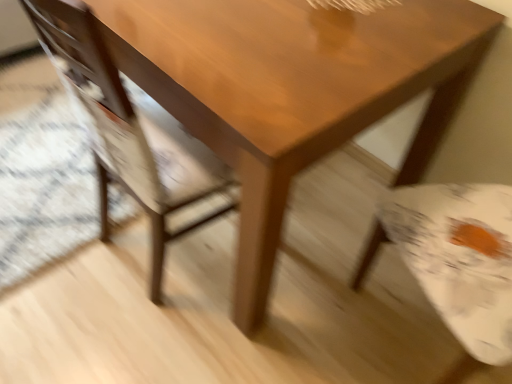
Measure the distance between point (x=77, y=58) and camera.

Point (x=77, y=58) and camera are 84.80 centimeters apart from each other.

The height and width of the screenshot is (384, 512). What do you see at coordinates (129, 131) in the screenshot?
I see `matte wood chair at center` at bounding box center [129, 131].

Find the location of `matte wood chair at center`. matte wood chair at center is located at coordinates 129,131.

This screenshot has width=512, height=384. What do you see at coordinates (293, 91) in the screenshot?
I see `glossy wood table at center` at bounding box center [293, 91].

In order to click on glossy wood table at center in this screenshot , I will do `click(293, 91)`.

The height and width of the screenshot is (384, 512). I want to click on matte wood chair at center, so click(x=129, y=131).

Visually, is matte wood chair at center positioned to the left or to the right of glossy wood table at center?

matte wood chair at center is positioned on glossy wood table at center's left side.

Who is more distant, matte wood chair at center or glossy wood table at center?

glossy wood table at center is further away from the camera.

Which point is more forward, (115,69) or (237,285)?

The point (115,69) is closer.

Consider the image. From the image's perspective, between matte wood chair at center and glossy wood table at center, who is located below?

matte wood chair at center is shown below in the image.

Looking at this image, from a real-world perspective, is matte wood chair at center beneath glossy wood table at center?

No, from a real-world perspective, matte wood chair at center is not beneath glossy wood table at center.

Consider the image. In terms of width, does matte wood chair at center look wider or thinner when compared to glossy wood table at center?

Considering their sizes, matte wood chair at center looks slimmer than glossy wood table at center.

Is matte wood chair at center taller or shorter than glossy wood table at center?

matte wood chair at center is taller than glossy wood table at center.

Considering the sizes of objects matte wood chair at center and glossy wood table at center in the image provided, who is bigger, matte wood chair at center or glossy wood table at center?

With larger size is glossy wood table at center.

Is matte wood chair at center situated inside glossy wood table at center or outside?

matte wood chair at center can be found inside glossy wood table at center.

Consider the image. Would you consider matte wood chair at center to be distant from glossy wood table at center?

No, there isn't a large distance between matte wood chair at center and glossy wood table at center.

Is matte wood chair at center oriented towards glossy wood table at center?

Yes, matte wood chair at center is turned towards glossy wood table at center.

How different are the orientations of matte wood chair at center and glossy wood table at center in degrees?

The facing directions of matte wood chair at center and glossy wood table at center are 177 degrees apart.

Locate an element on the screen. This screenshot has height=384, width=512. chair above the glossy wood table at center (from a real-world perspective) is located at coordinates (129, 131).

Considering the relative positions of glossy wood table at center and matte wood chair at center in the image provided, is glossy wood table at center to the right of matte wood chair at center from the viewer's perspective?

Yes, glossy wood table at center is to the right of matte wood chair at center.

Is glossy wood table at center further to the viewer compared to matte wood chair at center?

Yes.

Which is in front, point (237, 68) or point (98, 135)?

The point (237, 68) is closer to the camera.

In the scene shown: From the image's perspective, is glossy wood table at center beneath matte wood chair at center?

No, from the image's perspective, glossy wood table at center is not below matte wood chair at center.

From a real-world perspective, who is located lower, glossy wood table at center or matte wood chair at center?

In real-world perspective, glossy wood table at center is lower.

Is glossy wood table at center wider or thinner than matte wood chair at center?

In the image, glossy wood table at center appears to be wider than matte wood chair at center.

From their relative heights in the image, would you say glossy wood table at center is taller or shorter than matte wood chair at center?

glossy wood table at center is shorter than matte wood chair at center.

Considering the sizes of objects glossy wood table at center and matte wood chair at center in the image provided, who is bigger, glossy wood table at center or matte wood chair at center?

Bigger between the two is glossy wood table at center.

From the picture: Can we say glossy wood table at center lies outside matte wood chair at center?

Yes, glossy wood table at center is not within matte wood chair at center.

Is glossy wood table at center far away from matte wood chair at center?

No, glossy wood table at center is not far away from matte wood chair at center.

Is glossy wood table at center facing towards matte wood chair at center?

Yes, glossy wood table at center is aimed at matte wood chair at center.

How many degrees apart are the facing directions of glossy wood table at center and matte wood chair at center?

The angular difference between glossy wood table at center and matte wood chair at center is 177 degrees.

Find the location of `table on the right of matte wood chair at center`. table on the right of matte wood chair at center is located at coordinates (293, 91).

Locate an element on the screen. chair that is in front of the glossy wood table at center is located at coordinates (129, 131).

Image resolution: width=512 pixels, height=384 pixels. In order to click on chair that is on the left side of glossy wood table at center in this screenshot , I will do `click(129, 131)`.